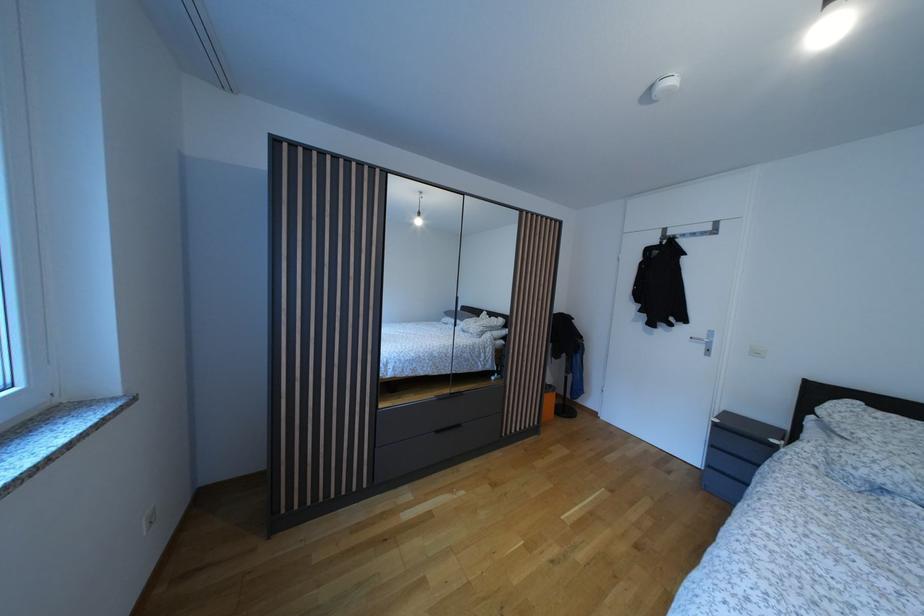
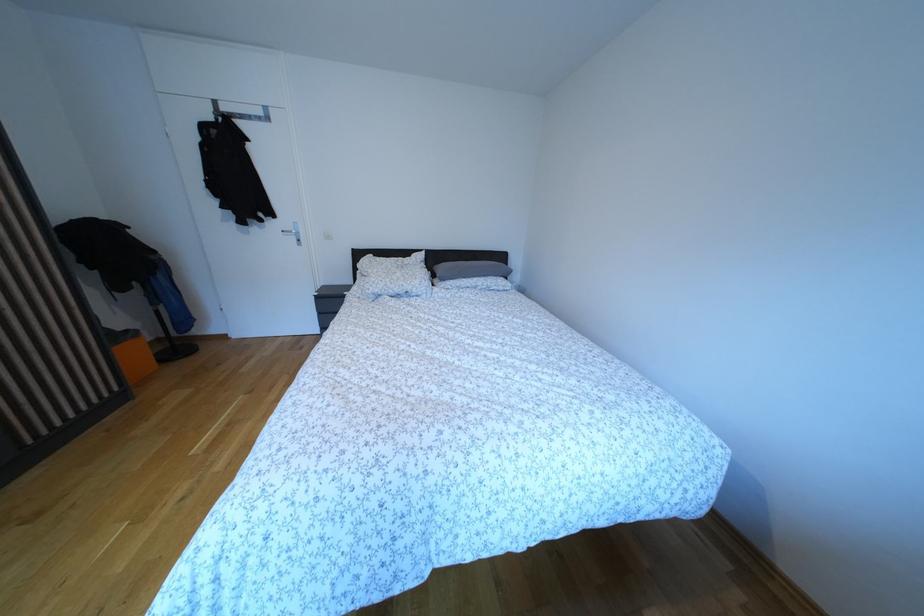
The point at (557, 392) is marked in the first image. Where is the corresponding point in the second image?

(134, 338)